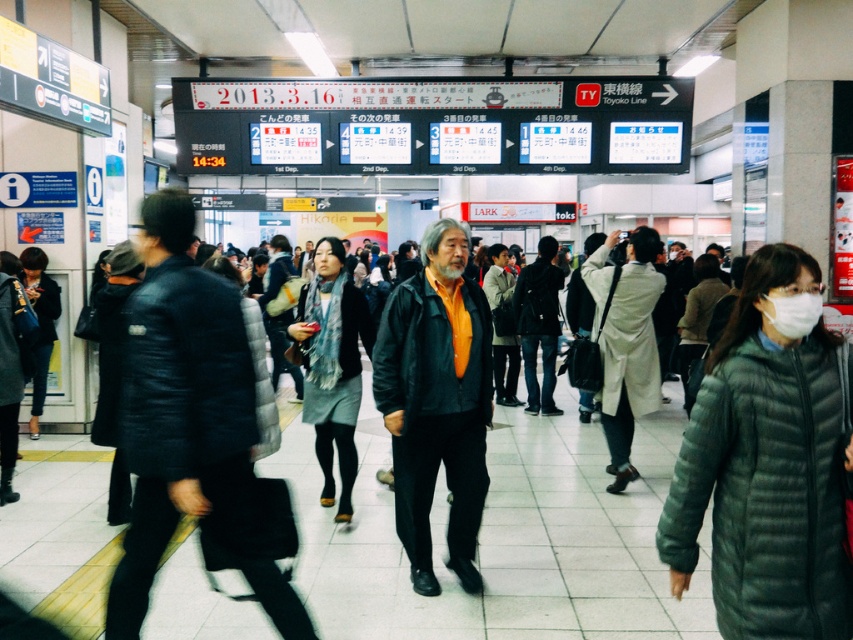
Question: Is matte black jacket at center bigger than leather jacket at center?

Choices:
 (A) no
 (B) yes

Answer: (B)

Question: Is gray down jacket at right thinner than light beige coat at center?

Choices:
 (A) no
 (B) yes

Answer: (A)

Question: Does gray wool scarf at center have a lesser width compared to leather jacket at center?

Choices:
 (A) yes
 (B) no

Answer: (B)

Question: Which object is positioned farthest from the gray down jacket at right?

Choices:
 (A) leather jacket at center
 (B) gray wool scarf at center
 (C) matte black jacket at center

Answer: (B)

Question: Which point is closer to the camera?

Choices:
 (A) gray down jacket at right
 (B) gray wool scarf at center

Answer: (A)

Question: Which object is closer to the camera taking this photo?

Choices:
 (A) light beige coat at center
 (B) matte black jacket at center
 (C) leather jacket at center

Answer: (C)